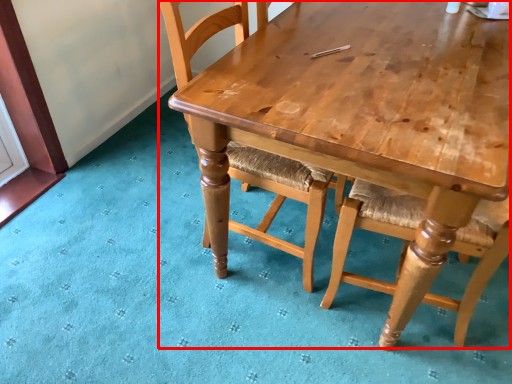
Question: Observing the image, what is the correct spatial positioning of table (annotated by the red box) in reference to chair?

Choices:
 (A) left
 (B) right

Answer: (B)